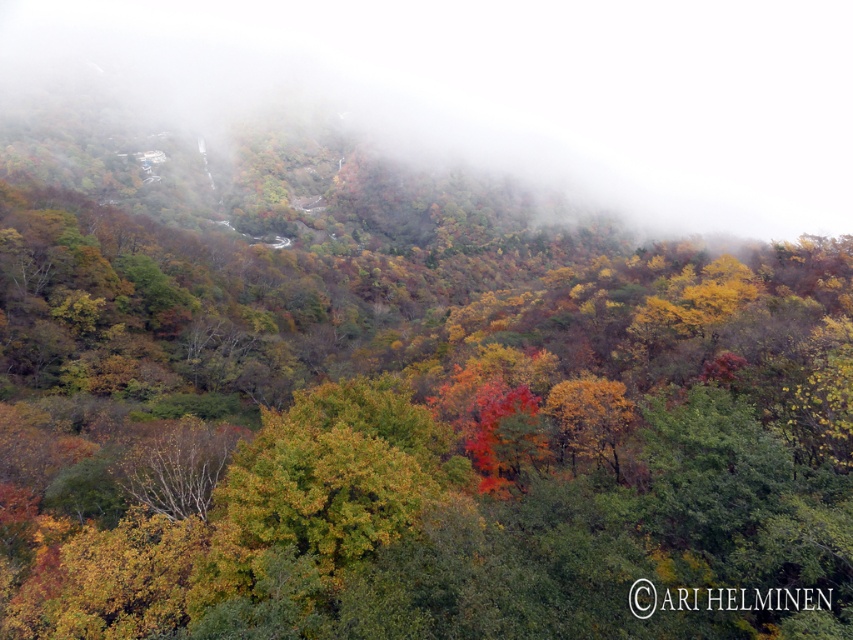
You are an artist trying to capture this autumn forest scene. You notice the foggy translucent mist at upper left and the golden yellow leaves at center. Which element is positioned higher in the image?

The foggy translucent mist at upper left is positioned higher than the golden yellow leaves at center.

You are a hiker trying to navigate through the misty forest. You see the foggy translucent mist at upper left and the golden yellow leaves at center. Which object is located above the other?

The foggy translucent mist at upper left is positioned over golden yellow leaves at center, so the mist is above the leaves.